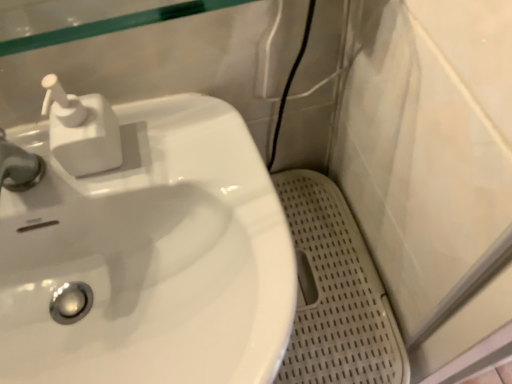
This screenshot has height=384, width=512. In order to click on vacant area that is situated to the right of white plastic soap dispenser at upper left in this screenshot , I will do click(189, 158).